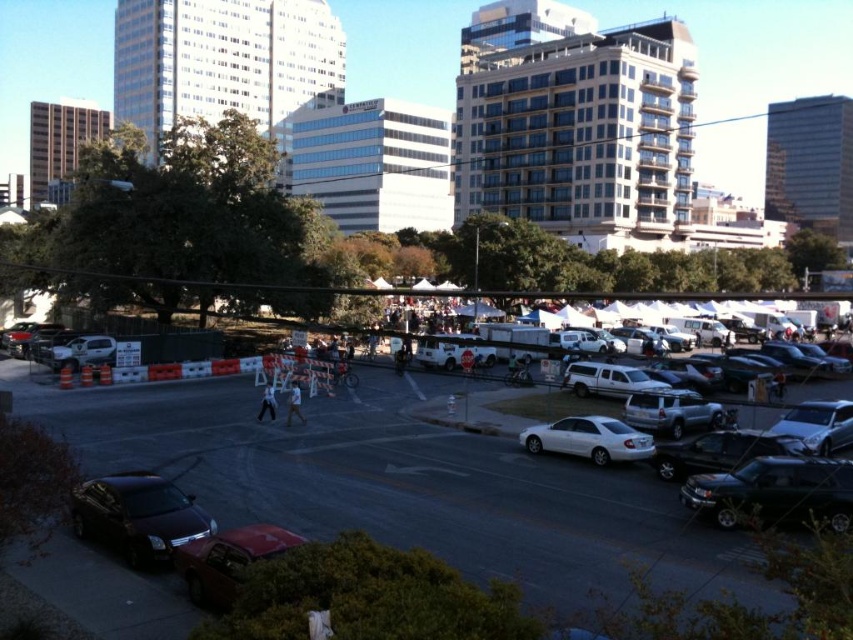
You are a delivery person needing to navigate between the shiny dark gray sedan at lower left and the metallic red car at lower left. Your delivery cart is 5 feet wide. Can you fit through the space between them?

The distance between the shiny dark gray sedan at lower left and the metallic red car at lower left is 5.73 feet. Since your cart is 5 feet wide, it should fit comfortably with a little space to spare.

You are a delivery driver who needs to park your vehicle in a low clearance garage. The garage has a height restriction of 1.8 meters. You have two options to choose from the image, the white matte sedan at center and the white matte truck at center. Which vehicle would you choose to park in the garage?

The white matte sedan at center has a lesser height compared to the white matte truck at center. Therefore, the white matte sedan at center is more suitable for parking in the low clearance garage with a 1.8 meters height restriction.